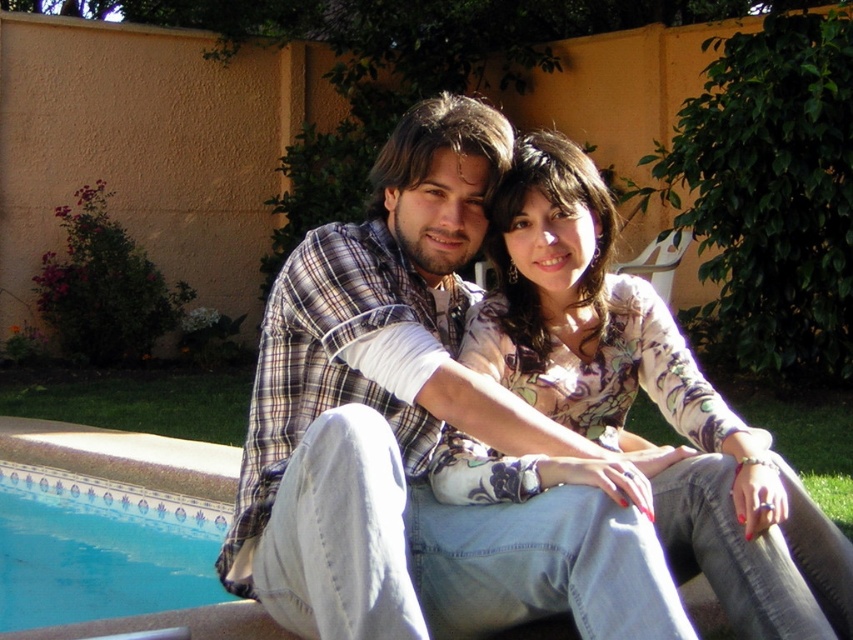
You are standing 5 feet away from the floral print blouse at center. Can you reach it without moving closer?

The floral print blouse at center is 6.27 feet away from the viewer. Since you are standing 5 feet away, you are closer than the required distance, so you can reach it without moving closer.

You are designing a seating arrangement for a couple. The man is wearing a plaid shirt at center and the woman is wearing a floral print blouse at center. Considering their clothing sizes, which clothing item would require more space in the seating area?

The plaid shirt at center has a larger size compared to the floral print blouse at center, so the plaid shirt at center would require more space in the seating area.